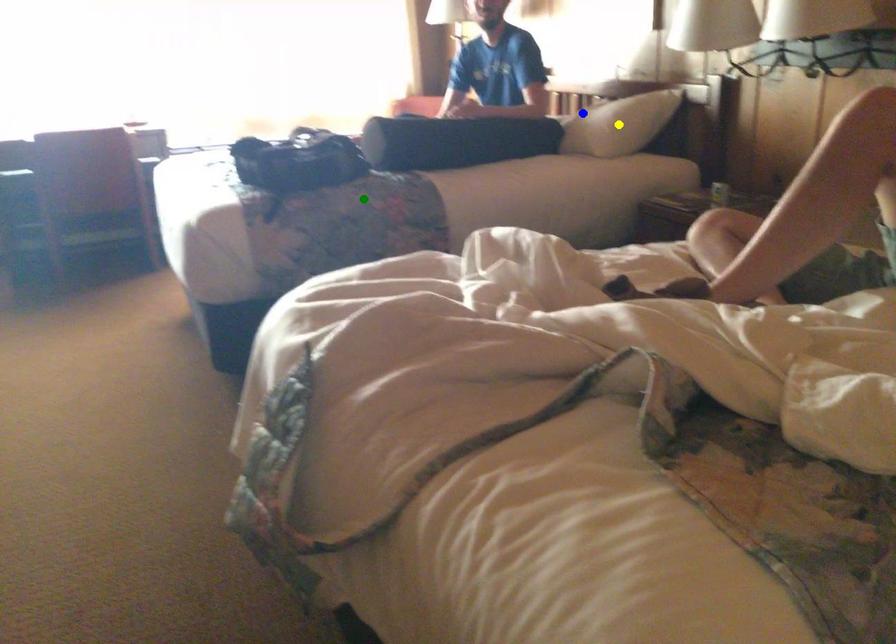
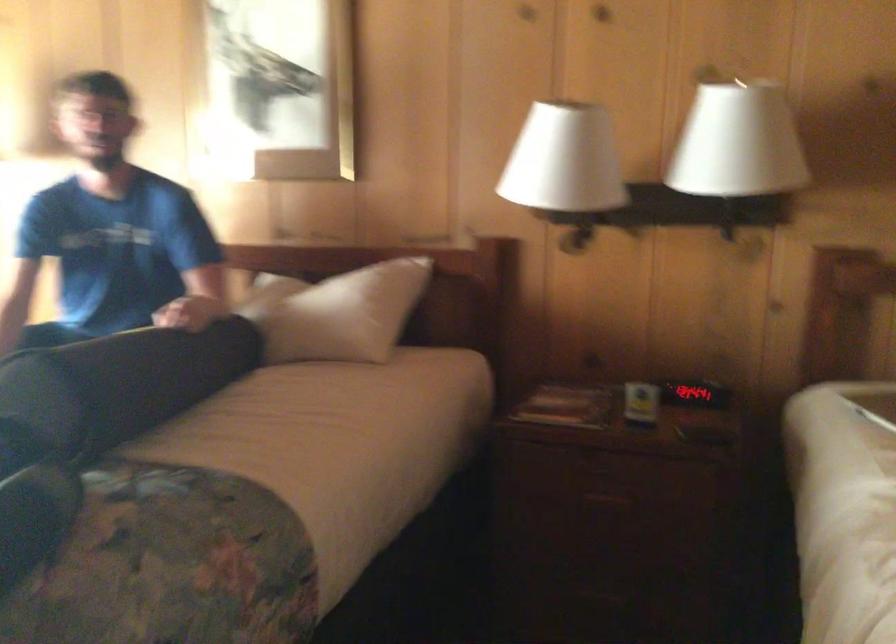
I am providing you with two images of the same scene from different viewpoints. Three points are marked in image1. Which point corresponds to a part or object that is occluded in image2?In image1, three points are marked. Which of them correspond to a part or object that is occluded in image2?Among the three points shown in image1, which one corresponds to a part or object that is no longer visible due to occlusion in image2?

yellow point